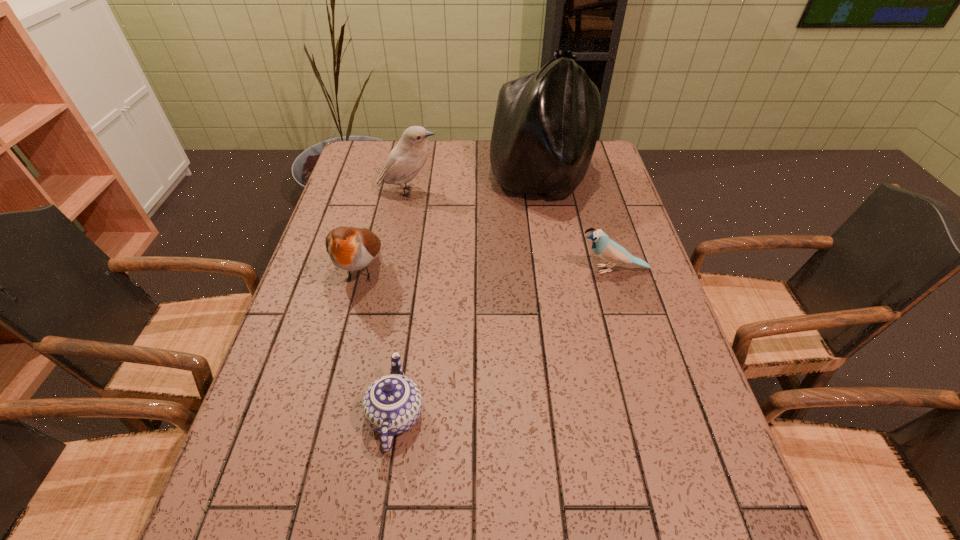
Where is `plastic bag`? The image size is (960, 540). plastic bag is located at coordinates (546, 124).

Where is `the farthest bird`? The image size is (960, 540). the farthest bird is located at coordinates (407, 158).

Find the location of a particular element. The width and height of the screenshot is (960, 540). the third tallest object is located at coordinates (350, 248).

This screenshot has width=960, height=540. Identify the location of the shortest bird. (608, 250).

Identify the location of the rightmost bird. (608, 250).

At what (x,y) coordinates should I click in order to perform the action: click on the nearest object. Please return your answer as a coordinate pair (x, y). The image size is (960, 540). Looking at the image, I should click on (392, 404).

This screenshot has height=540, width=960. I want to click on chinaware, so click(392, 404).

Locate an element on the screen. The height and width of the screenshot is (540, 960). vacant space situated on the left of the tallest object is located at coordinates (474, 181).

This screenshot has height=540, width=960. I want to click on vacant area situated 0.340m at the beak of the farthest bird, so click(x=545, y=192).

Identify the location of vacant space located at the face of the second shortest bird. (318, 436).